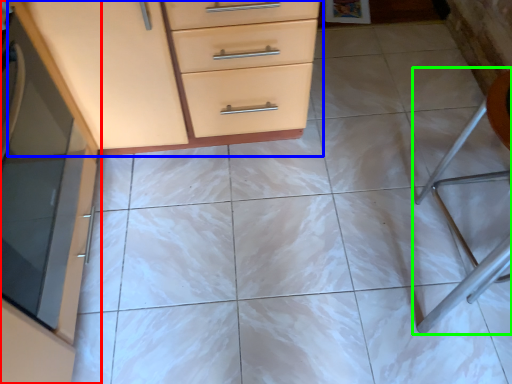
Question: Estimate the real-world distances between objects in this image. Which object is farther from cabinetry (highlighted by a red box), chest of drawers (highlighted by a blue box) or folding chair (highlighted by a green box)?

Choices:
 (A) chest of drawers
 (B) folding chair

Answer: (B)